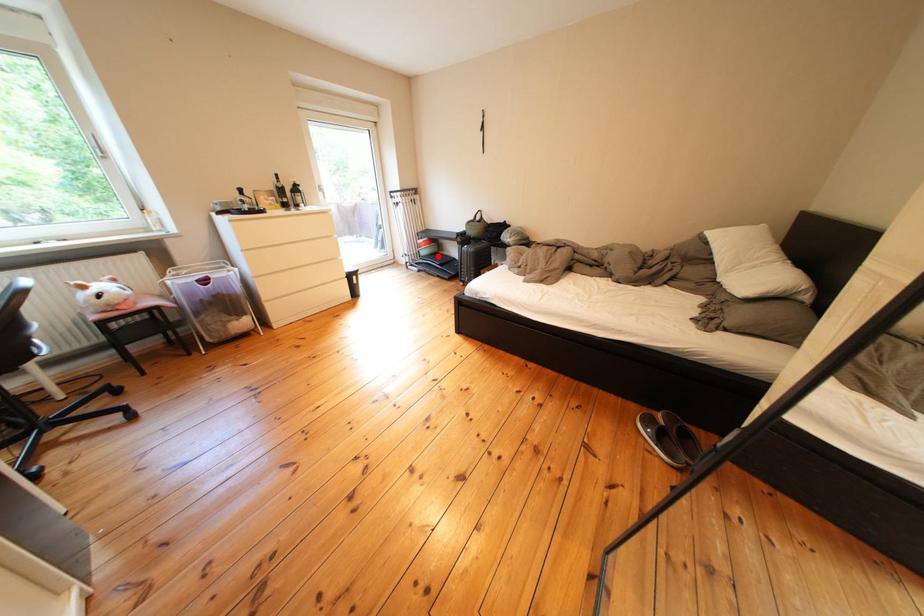
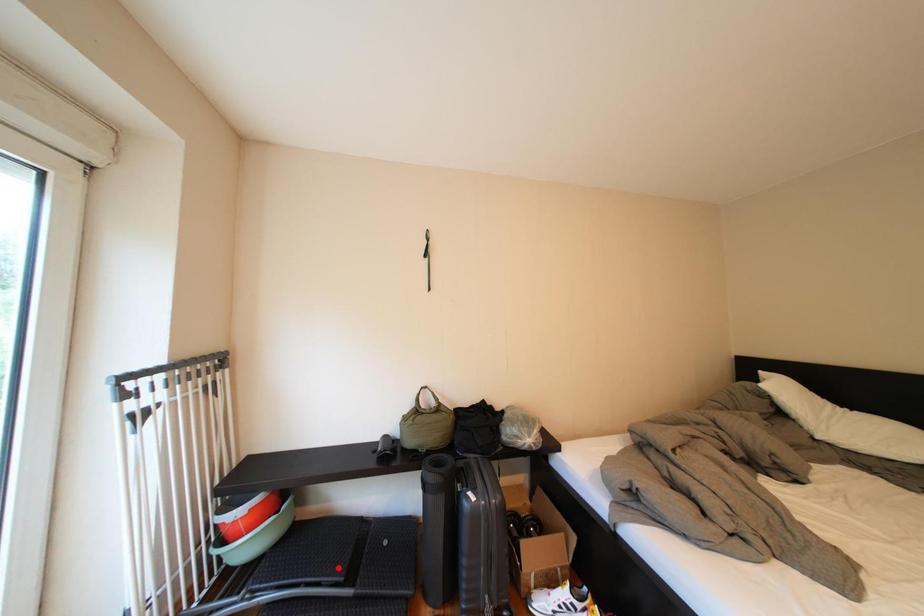
I am providing you with two images of the same scene from different viewpoints. A red point is marked on the first image and another point is marked on the second image. Do the highlighted points in image1 and image2 indicate the same real-world spot?

No